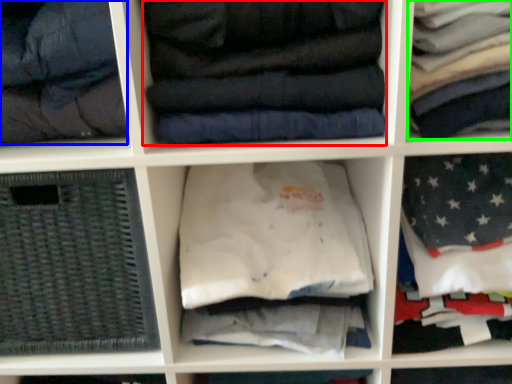
Question: Based on their relative distances, which object is farther from clothing (highlighted by a red box)? Choose from garment (highlighted by a blue box) and clothing (highlighted by a green box).

Choices:
 (A) garment
 (B) clothing

Answer: (A)